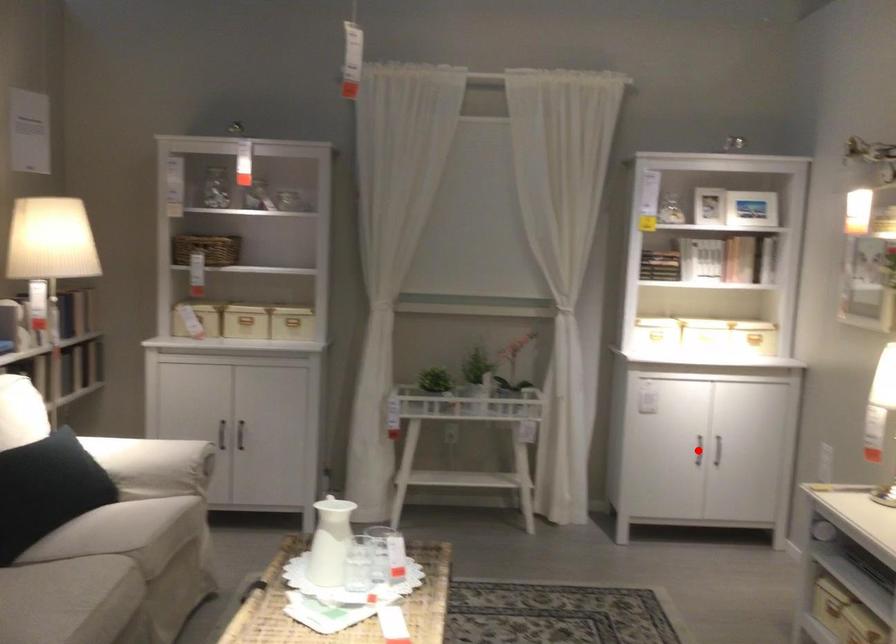
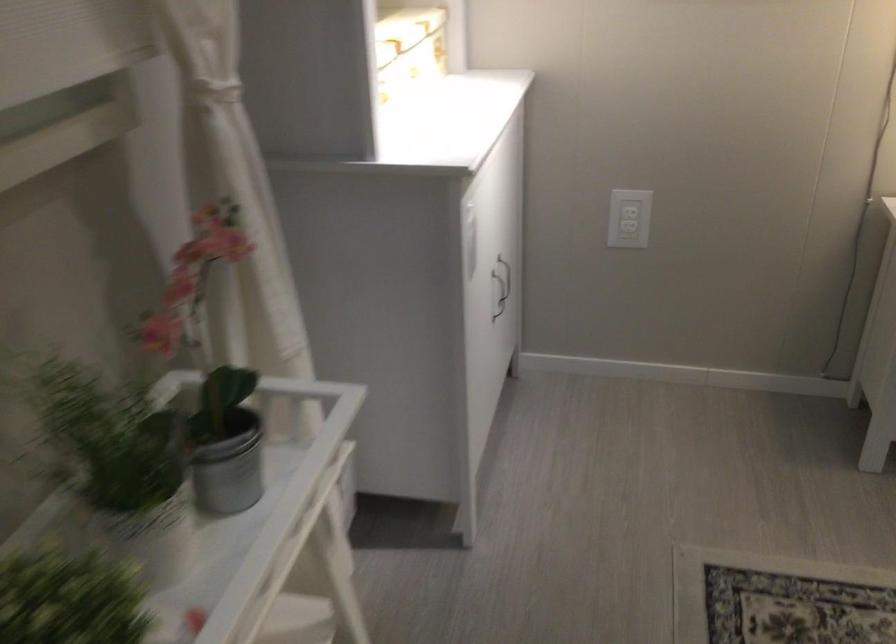
Question: I am providing you with two images of the same scene from different viewpoints. A red point is marked on the first image. At the location where the point appears in image 1, is it still visible in image 2?

Choices:
 (A) Yes
 (B) No

Answer: (B)